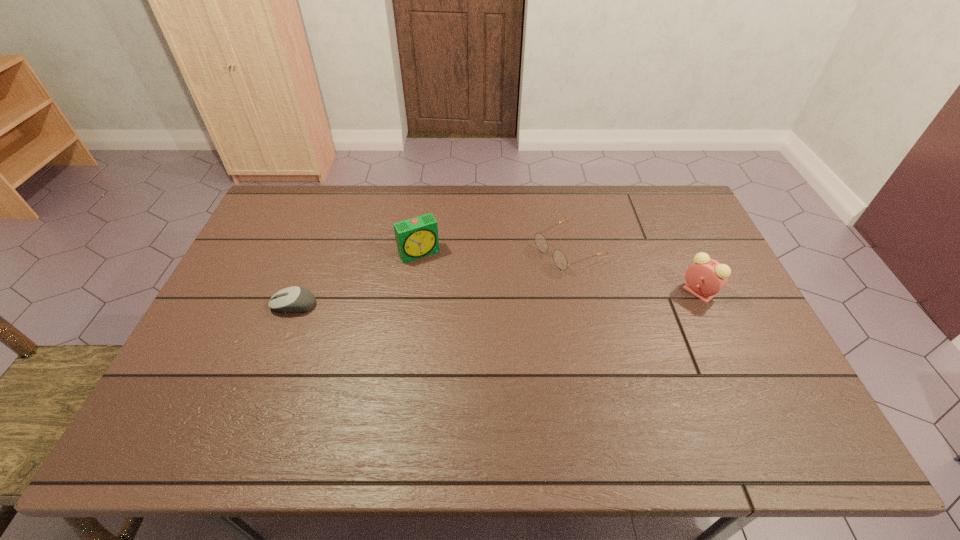
Image resolution: width=960 pixels, height=540 pixels. I want to click on free spot between the right alarm clock and the spectacles, so click(x=634, y=271).

Locate an element on the screen. Image resolution: width=960 pixels, height=540 pixels. free space between the shortest object and the third object from right to left is located at coordinates (356, 279).

Where is `free space between the third object from left to right and the right alarm clock`? free space between the third object from left to right and the right alarm clock is located at coordinates (634, 271).

Image resolution: width=960 pixels, height=540 pixels. I want to click on vacant space that is in between the farther alarm clock and the right alarm clock, so click(x=559, y=272).

You are a GUI agent. You are given a task and a screenshot of the screen. Output one action in this format:
    pyautogui.click(x=<x>, y=<y>)
    Task: Click on the vacant area that lies between the nearer alarm clock and the leftmost object
    The height and width of the screenshot is (540, 960).
    Given the screenshot: What is the action you would take?
    pyautogui.click(x=496, y=299)

Where is `the third closest object to the second object from right to left`? The height and width of the screenshot is (540, 960). the third closest object to the second object from right to left is located at coordinates (295, 299).

Select which object appears as the closest to the right alarm clock. Please provide its 2D coordinates. Your answer should be formatted as a tuple, i.e. [(x, y)], where the tuple contains the x and y coordinates of a point satisfying the conditions above.

[(559, 258)]

The image size is (960, 540). Find the location of `free space that satisfies the following two spatial constraints: 1. on the front side of the spectacles; 2. on the face of the nearer alarm clock`. free space that satisfies the following two spatial constraints: 1. on the front side of the spectacles; 2. on the face of the nearer alarm clock is located at coordinates (578, 292).

Image resolution: width=960 pixels, height=540 pixels. Find the location of `blank area in the image that satisfies the following two spatial constraints: 1. on the front side of the nearer alarm clock; 2. on the face of the farther alarm clock`. blank area in the image that satisfies the following two spatial constraints: 1. on the front side of the nearer alarm clock; 2. on the face of the farther alarm clock is located at coordinates (414, 292).